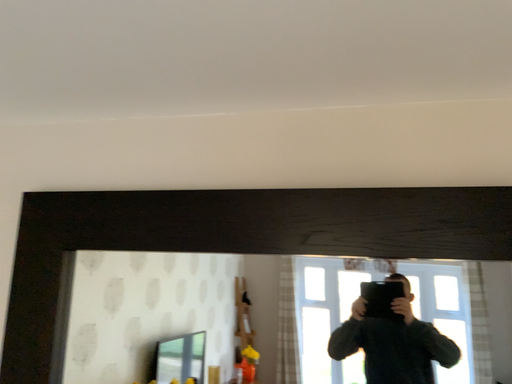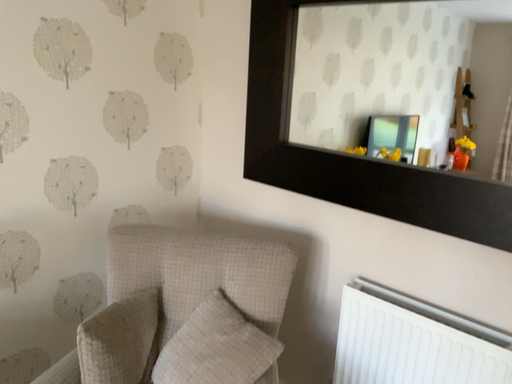
Question: Which way did the camera rotate in the video?

Choices:
 (A) rotated left
 (B) rotated right

Answer: (A)